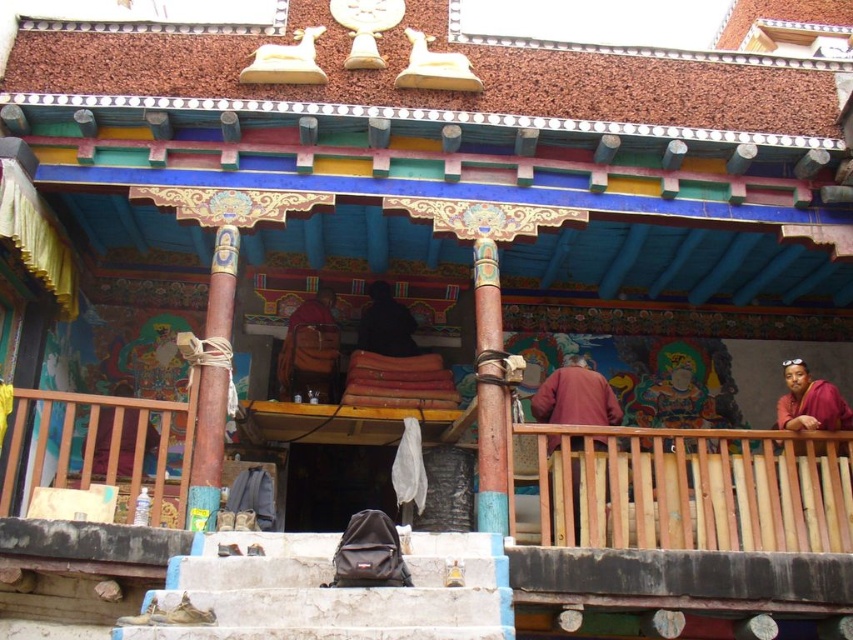
You are a traveler approaching the entrance of the building and see the white stone stairs at lower center and the maroon woolen robe at center. Which object is located to the left when facing the entrance?

The white stone stairs at lower center is positioned on the left side of maroon woolen robe at center, so when facing the entrance, the white stone stairs at lower center is to the left.

You are standing at the base of the white stone stairs at lower center and want to reach the entrance of the building. Which direction should you move relative to the maroon woolen robe at center?

Since the white stone stairs at lower center is in front of the maroon woolen robe at center, you should move towards the building away from the maroon woolen robe at center to reach the entrance.